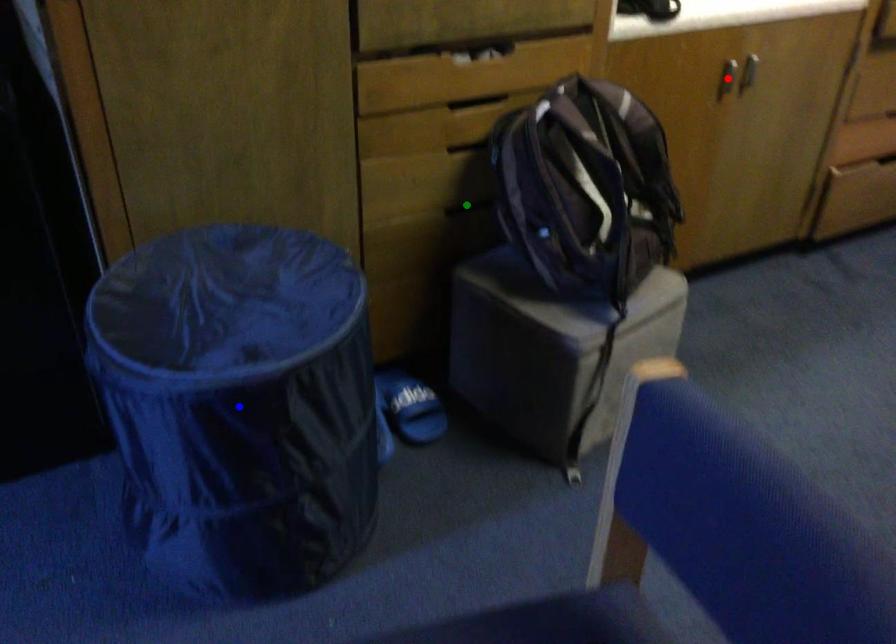
Order these from nearest to farthest:
green point | red point | blue point

blue point, green point, red point